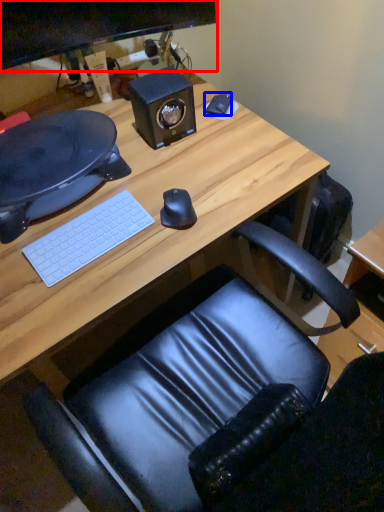
Question: Which object appears closest to the camera in this image, computer monitor (highlighted by a red box) or notepad (highlighted by a blue box)?

Choices:
 (A) computer monitor
 (B) notepad

Answer: (A)